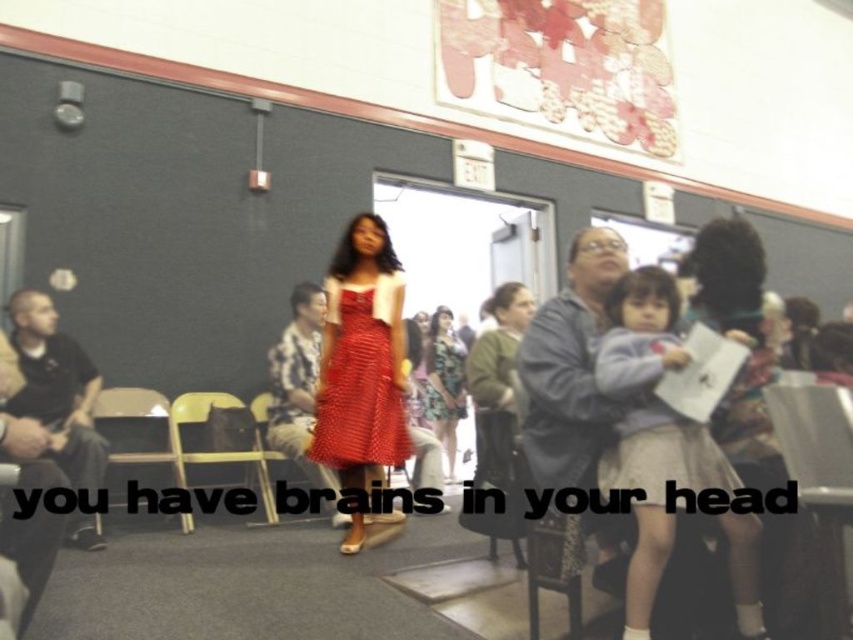
Does polka dot dress at center have a lesser width compared to yellow plastic chair at lower left?

Yes.

Which is behind, point (451, 364) or point (192, 531)?

Positioned behind is point (451, 364).

The width and height of the screenshot is (853, 640). I want to click on polka dot dress at center, so click(x=444, y=380).

Is point (612, 296) closer to viewer compared to point (347, 454)?

Yes, point (612, 296) is closer to viewer.

Between light blue fabric skirt at lower right and polka dot fabric dress at center, which one is positioned higher?

polka dot fabric dress at center

Between point (645, 605) and point (341, 408), which one is positioned in front?

Positioned in front is point (645, 605).

Locate an element on the screen. light blue fabric skirt at lower right is located at coordinates (650, 429).

This screenshot has width=853, height=640. What do you see at coordinates (358, 394) in the screenshot? I see `polka dot fabric dress at center` at bounding box center [358, 394].

Does polka dot fabric dress at center appear over matte red dress at center?

Yes.

Locate an element on the screen. polka dot fabric dress at center is located at coordinates (358, 394).